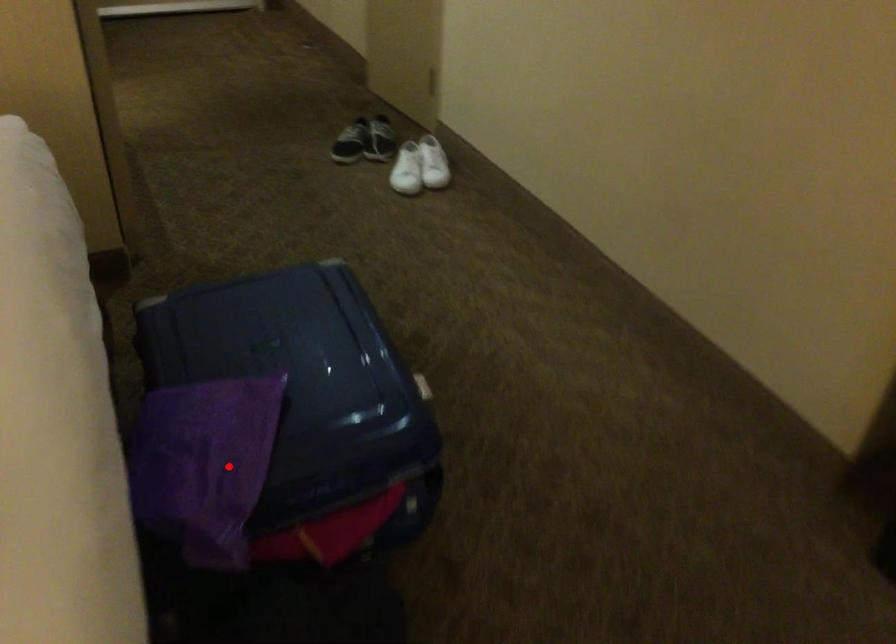
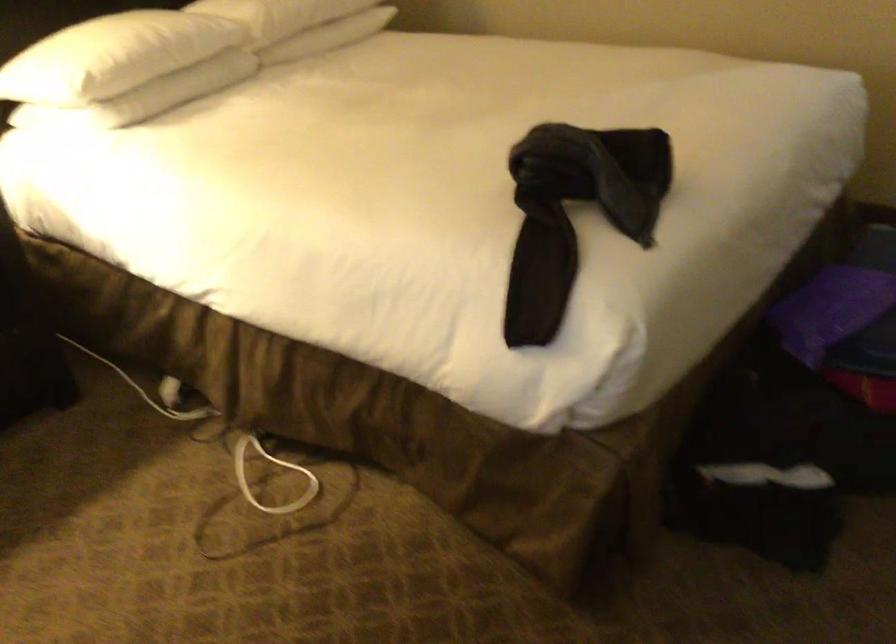
Question: A red point is marked in image1. In image2, is the corresponding 3D point closer to the camera or farther? Reply with the corresponding letter.

Choices:
 (A) The corresponding 3D point is closer.
 (B) The corresponding 3D point is farther.

Answer: (B)